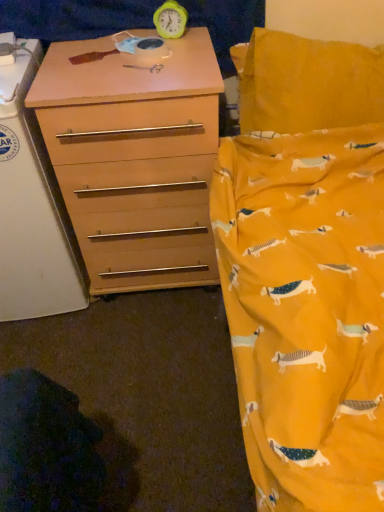
What do you see at coordinates (32, 209) in the screenshot?
I see `matte wood changing table at left` at bounding box center [32, 209].

Describe the element at coordinates (133, 156) in the screenshot. This screenshot has width=384, height=512. I see `matte wood chest of drawers at left` at that location.

You are a GUI agent. You are given a task and a screenshot of the screen. Output one action in this format:
    pyautogui.click(x=<x>, y=<y>)
    Task: Click on the matte wood changing table at left
    The height and width of the screenshot is (512, 384).
    Given the screenshot: What is the action you would take?
    pyautogui.click(x=32, y=209)

Considering the positions of point (168, 10) and point (75, 259), is point (168, 10) closer or farther from the camera than point (75, 259)?

Point (168, 10) is positioned closer to the camera compared to point (75, 259).

Between green plastic clock at upper center and matte wood changing table at left, which one has smaller size?

green plastic clock at upper center.

From a real-world perspective, who is located higher, green plastic clock at upper center or matte wood changing table at left?

green plastic clock at upper center.

Is matte wood changing table at left at the back of green plastic clock at upper center?

No, green plastic clock at upper center is not facing the opposite direction of matte wood changing table at left.

Can you confirm if matte wood chest of drawers at left is taller than matte wood changing table at left?

In fact, matte wood chest of drawers at left may be shorter than matte wood changing table at left.

Would you say matte wood chest of drawers at left contains matte wood changing table at left?

That's incorrect, matte wood changing table at left is not inside matte wood chest of drawers at left.

In the image, is matte wood chest of drawers at left positioned in front of or behind matte wood changing table at left?

matte wood chest of drawers at left is behind matte wood changing table at left.

Is point (164, 266) positioned behind point (80, 258)?

That is True.

Is matte wood changing table at left completely or partially outside of green plastic clock at upper center?

That's correct, matte wood changing table at left is outside of green plastic clock at upper center.

In the scene shown: Does matte wood changing table at left come behind green plastic clock at upper center?

No.

Could you tell me if matte wood changing table at left is facing green plastic clock at upper center?

No.

Which object is closer to the camera, matte wood chest of drawers at left or green plastic clock at upper center?

matte wood chest of drawers at left.

Considering the relative sizes of matte wood chest of drawers at left and green plastic clock at upper center in the image provided, is matte wood chest of drawers at left smaller than green plastic clock at upper center?

No, matte wood chest of drawers at left is not smaller than green plastic clock at upper center.

This screenshot has width=384, height=512. What are the coordinates of `the chest of drawers that is under the green plastic clock at upper center (from a real-world perspective)` in the screenshot? It's located at (133, 156).

Is matte wood chest of drawers at left to the right of green plastic clock at upper center from the viewer's perspective?

No.

From a real-world perspective, does green plastic clock at upper center stand above matte wood chest of drawers at left?

Correct, in the physical world, green plastic clock at upper center is higher than matte wood chest of drawers at left.

Can you confirm if green plastic clock at upper center is wider than matte wood chest of drawers at left?

In fact, green plastic clock at upper center might be narrower than matte wood chest of drawers at left.

From the image's perspective, which object appears higher, green plastic clock at upper center or matte wood chest of drawers at left?

From the image's view, green plastic clock at upper center is above.

Is green plastic clock at upper center positioned behind matte wood chest of drawers at left?

Yes, the depth of green plastic clock at upper center is greater than that of matte wood chest of drawers at left.

Can you confirm if matte wood changing table at left is positioned to the left of matte wood chest of drawers at left?

Yes, matte wood changing table at left is to the left of matte wood chest of drawers at left.

Is matte wood changing table at left oriented towards matte wood chest of drawers at left?

No, matte wood changing table at left is not oriented towards matte wood chest of drawers at left.

Is point (14, 284) closer to viewer compared to point (142, 248)?

Yes, point (14, 284) is in front of point (142, 248).

Identify the location of changing table on the left of green plastic clock at upper center. The image size is (384, 512). (32, 209).

Where is `changing table located above the matte wood chest of drawers at left (from a real-world perspective)`? The image size is (384, 512). changing table located above the matte wood chest of drawers at left (from a real-world perspective) is located at coordinates (32, 209).

Based on their spatial positions, is green plastic clock at upper center or matte wood chest of drawers at left closer to matte wood changing table at left?

Among the two, matte wood chest of drawers at left is located nearer to matte wood changing table at left.

Consider the image. Considering their positions, is matte wood changing table at left positioned closer to matte wood chest of drawers at left than green plastic clock at upper center?

matte wood changing table at left.

When comparing their distances from green plastic clock at upper center, does matte wood chest of drawers at left or matte wood changing table at left seem closer?

matte wood chest of drawers at left.

In the scene shown: From the image, which object appears to be farther from matte wood changing table at left, matte wood chest of drawers at left or green plastic clock at upper center?

green plastic clock at upper center is positioned further to the anchor matte wood changing table at left.

Estimate the real-world distances between objects in this image. Which object is closer to matte wood chest of drawers at left, green plastic clock at upper center or matte wood changing table at left?

Based on the image, matte wood changing table at left appears to be nearer to matte wood chest of drawers at left.

From the image, which object appears to be farther from green plastic clock at upper center, matte wood changing table at left or matte wood chest of drawers at left?

Among the two, matte wood changing table at left is located further to green plastic clock at upper center.

Where is `the chest of drawers situated between matte wood changing table at left and green plastic clock at upper center from left to right`? The width and height of the screenshot is (384, 512). the chest of drawers situated between matte wood changing table at left and green plastic clock at upper center from left to right is located at coordinates (133, 156).